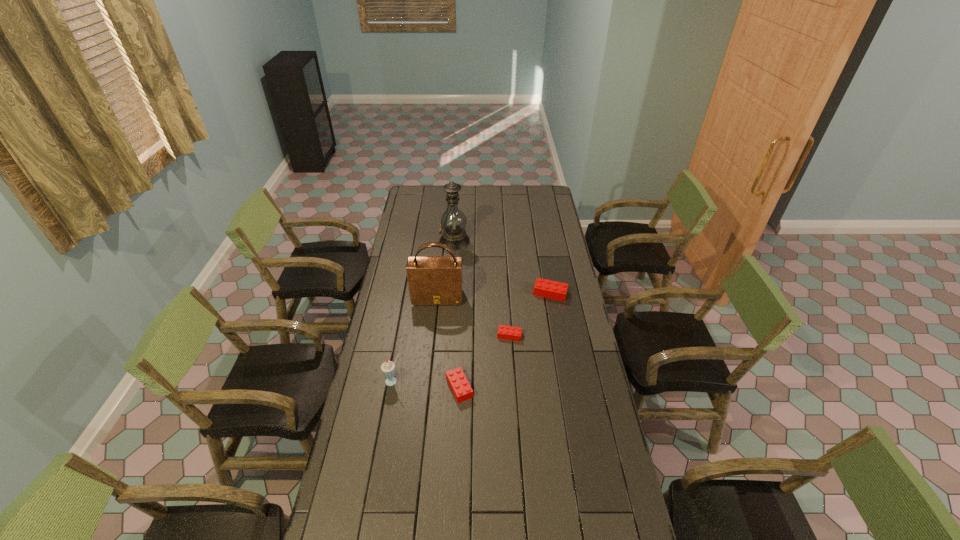
Where is `vacant area between the fourth shortest object and the leftmost Lego`? The width and height of the screenshot is (960, 540). vacant area between the fourth shortest object and the leftmost Lego is located at coordinates (426, 384).

At what (x,y) coordinates should I click in order to perform the action: click on free space between the second shortest Lego and the third tallest object. Please return your answer as a coordinate pair (x, y). Looking at the image, I should click on (426, 384).

The image size is (960, 540). I want to click on the fourth closest object to the fifth tallest object, so click(x=555, y=290).

Find the location of a particular element. The image size is (960, 540). object that is the fourth closest one to the nearest Lego is located at coordinates (555, 290).

This screenshot has height=540, width=960. I want to click on Lego that can be found as the closest to the fifth shortest object, so click(504, 332).

Locate an element on the screen. the second closest Lego relative to the second tallest object is located at coordinates (555, 290).

This screenshot has width=960, height=540. What are the coordinates of `free spot that satisfies the following two spatial constraints: 1. on the back side of the shortest Lego; 2. on the left side of the nearest Lego` in the screenshot? It's located at (462, 335).

Where is `free location that satisfies the following two spatial constraints: 1. on the straw side of the second tallest Lego; 2. on the right side of the milkshake`? Image resolution: width=960 pixels, height=540 pixels. free location that satisfies the following two spatial constraints: 1. on the straw side of the second tallest Lego; 2. on the right side of the milkshake is located at coordinates (393, 388).

Find the location of a particular element. The image size is (960, 540). free location that satisfies the following two spatial constraints: 1. on the front flap of the shoulder bag; 2. on the left side of the shortest object is located at coordinates (433, 335).